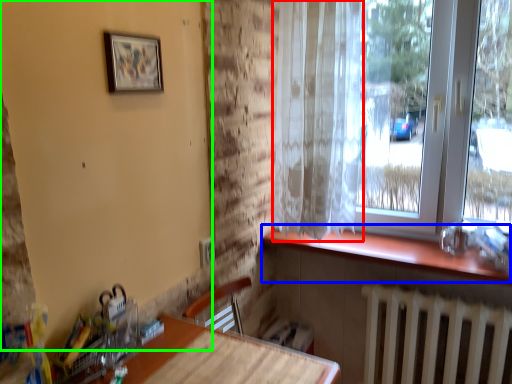
Question: Which object is positioned farthest from curtain (highlighted by a red box)? Select from window sill (highlighted by a blue box) and backdrop (highlighted by a green box).

Choices:
 (A) window sill
 (B) backdrop

Answer: (B)